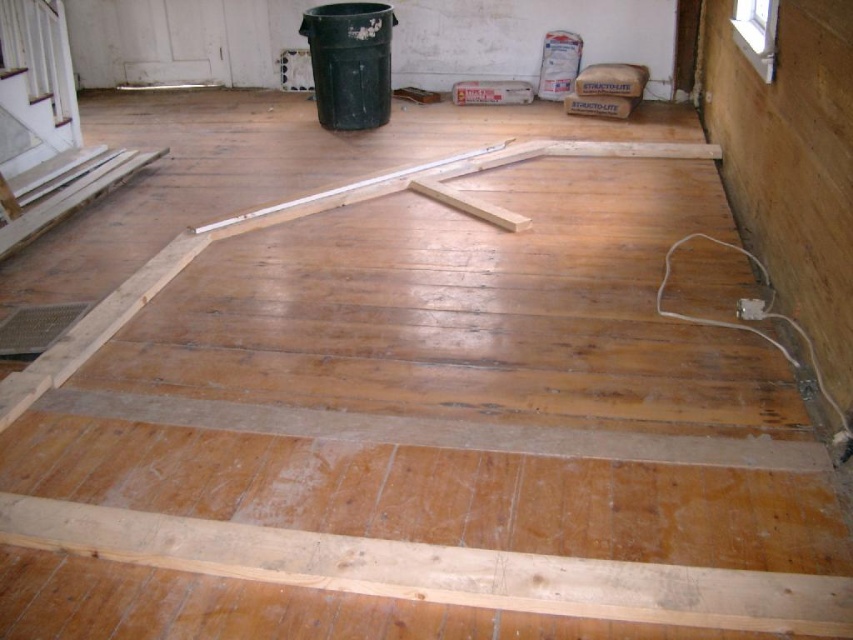
Between natural wood plank at bottom and light wood/rough beam at center, which one is positioned higher?

light wood/rough beam at center is higher up.

Is point (97, 516) positioned before point (392, 177)?

Yes.

Where is `natural wood plank at bottom`? natural wood plank at bottom is located at coordinates (439, 570).